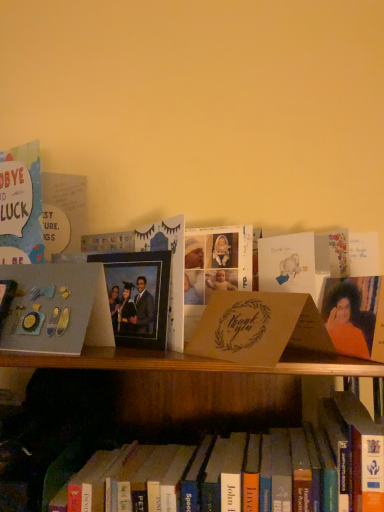
Question: Is matte brown card at center, the 2th paperback book when ordered from right to left, wider or thinner than matte gray paper at left, the 1th paperback book viewed from the left?

Choices:
 (A) thin
 (B) wide

Answer: (B)

Question: From a real-world perspective, is matte brown card at center, placed as the 2th paperback book when sorted from left to right, above or below matte gray paper at left, the 1th paperback book viewed from the left?

Choices:
 (A) above
 (B) below

Answer: (B)

Question: Which object is positioned closest to the matte brown card at center, the 2th paperback book when ordered from right to left?

Choices:
 (A) hardcover book at center, the first book viewed from the right
 (B) matte blue card at left, the second book in the bottom-to-top sequence
 (C) matte gray paper at left, the 3th paperback book from the right
 (D) matte black photo frame at center
 (E) matte brown card at center, the third paperback book positioned from the left

Answer: (E)

Question: Which object is the farthest from the matte brown card at center, the 2th paperback book when ordered from right to left?

Choices:
 (A) hardcover book at center, the first book viewed from the right
 (B) matte gray paper at left, the 1th paperback book viewed from the left
 (C) matte brown card at center, which appears as the first paperback book when viewed from the right
 (D) orange fabric portrait at right
 (E) matte blue card at left, marked as the first book in a top-to-bottom arrangement

Answer: (E)